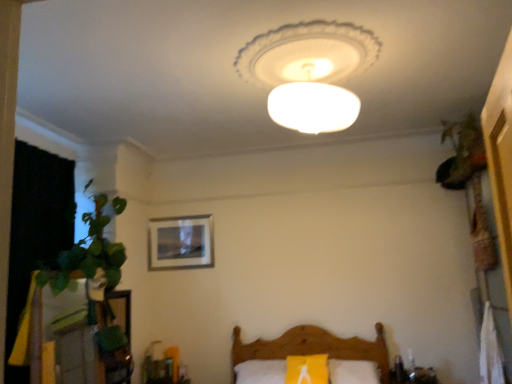
Locate an element on the screen. The image size is (512, 384). white frosted glass lampshade at center is located at coordinates (309, 72).

Identify the location of wooden picture frame at center. Image resolution: width=512 pixels, height=384 pixels. (180, 243).

Where is `green leafy plant at upper right`? This screenshot has width=512, height=384. green leafy plant at upper right is located at coordinates (462, 152).

Locate an element on the screen. white frosted glass lampshade at center is located at coordinates (309, 72).

The width and height of the screenshot is (512, 384). I want to click on plant on the right of wooden picture frame at center, so click(462, 152).

Does wooden picture frame at center appear on the right side of green leafy plant at upper right?

No.

Is wooden picture frame at center not within green leafy plant at upper right?

wooden picture frame at center lies outside green leafy plant at upper right's area.

Does green leafy plant at upper right have a greater width compared to white frosted glass lampshade at center?

No.

Is green leafy plant at upper right spatially inside white frosted glass lampshade at center, or outside of it?

green leafy plant at upper right cannot be found inside white frosted glass lampshade at center.

Based on the photo, would you consider green leafy plant at upper right to be distant from white frosted glass lampshade at center?

That's right, there is a large distance between green leafy plant at upper right and white frosted glass lampshade at center.

Considering the relative positions of green leafy plant at upper right and white frosted glass lampshade at center in the image provided, is green leafy plant at upper right to the left or to the right of white frosted glass lampshade at center?

green leafy plant at upper right is positioned on white frosted glass lampshade at center's right side.

Locate an element on the screen. The image size is (512, 384). picture frame that is below the green leafy plant at upper right (from the image's perspective) is located at coordinates (180, 243).

From a real-world perspective, who is located higher, green leafy plant at upper right or wooden picture frame at center?

green leafy plant at upper right.

Can you see green leafy plant at upper right touching wooden picture frame at center?

green leafy plant at upper right and wooden picture frame at center are clearly separated.

Considering the sizes of green leafy plant at upper right and wooden picture frame at center in the image, is green leafy plant at upper right bigger or smaller than wooden picture frame at center?

Clearly, green leafy plant at upper right is larger in size than wooden picture frame at center.

Is wooden picture frame at center behind wooden bed at lower center?

Yes, the depth of wooden picture frame at center is greater than that of wooden bed at lower center.

Locate an element on the screen. This screenshot has height=384, width=512. picture frame that appears on the left of wooden bed at lower center is located at coordinates (180, 243).

Is the surface of wooden picture frame at center in direct contact with wooden bed at lower center?

No, wooden picture frame at center is not making contact with wooden bed at lower center.

What's the angular difference between white frosted glass lampshade at center and wooden bed at lower center's facing directions?

The angular difference between white frosted glass lampshade at center and wooden bed at lower center is 170 degrees.

Based on the photo, from the image's perspective, between white frosted glass lampshade at center and wooden bed at lower center, which one is located above?

white frosted glass lampshade at center appears higher in the image.

From a real-world perspective, is white frosted glass lampshade at center physically located above or below wooden bed at lower center?

white frosted glass lampshade at center is above wooden bed at lower center.

Which is behind, point (297, 119) or point (452, 129)?

The point (452, 129) is behind.

Which of these two, white frosted glass lampshade at center or green leafy plant at upper right, is smaller?

Smaller between the two is green leafy plant at upper right.

Does white frosted glass lampshade at center appear on the right side of green leafy plant at upper right?

In fact, white frosted glass lampshade at center is to the left of green leafy plant at upper right.

At what (x,y) coordinates should I click in order to perform the action: click on picture frame behind the wooden bed at lower center. Please return your answer as a coordinate pair (x, y). Looking at the image, I should click on (180, 243).

From a real-world perspective, is wooden bed at lower center on top of wooden picture frame at center?

No, from a real-world perspective, wooden bed at lower center is not over wooden picture frame at center

Between wooden bed at lower center and wooden picture frame at center, which one appears on the left side from the viewer's perspective?

From the viewer's perspective, wooden picture frame at center appears more on the left side.

What's the angular difference between wooden bed at lower center and wooden picture frame at center's facing directions?

There is a 1.2-degree angle between the facing directions of wooden bed at lower center and wooden picture frame at center.

You are a GUI agent. You are given a task and a screenshot of the screen. Output one action in this format:
    pyautogui.click(x=<x>, y=<y>)
    Task: Click on the picture frame located behind the green leafy plant at upper right
    
    Given the screenshot: What is the action you would take?
    pyautogui.click(x=180, y=243)

The height and width of the screenshot is (384, 512). I want to click on plant below the white frosted glass lampshade at center (from the image's perspective), so click(462, 152).

When comparing their distances from wooden bed at lower center, does white frosted glass lampshade at center or wooden picture frame at center seem closer?

The object closer to wooden bed at lower center is wooden picture frame at center.

Which object lies nearer to the anchor point wooden bed at lower center, wooden picture frame at center or white frosted glass lampshade at center?

wooden picture frame at center lies closer to wooden bed at lower center than the other object.

From the image, which object appears to be nearer to wooden picture frame at center, green leafy plant at upper right or wooden bed at lower center?

wooden bed at lower center lies closer to wooden picture frame at center than the other object.

When comparing their distances from white frosted glass lampshade at center, does wooden picture frame at center or wooden bed at lower center seem closer?

wooden picture frame at center lies closer to white frosted glass lampshade at center than the other object.

Based on the photo, based on their spatial positions, is green leafy plant at upper right or wooden bed at lower center further from white frosted glass lampshade at center?

wooden bed at lower center is further to white frosted glass lampshade at center.

Estimate the real-world distances between objects in this image. Which object is closer to wooden bed at lower center, green leafy plant at upper right or white frosted glass lampshade at center?

Among the two, green leafy plant at upper right is located nearer to wooden bed at lower center.

Looking at the image, which one is located closer to green leafy plant at upper right, wooden picture frame at center or wooden bed at lower center?

wooden bed at lower center.

From the image, which object appears to be nearer to green leafy plant at upper right, white frosted glass lampshade at center or wooden picture frame at center?

The object closer to green leafy plant at upper right is white frosted glass lampshade at center.

Where is `furniture located between wooden picture frame at center and green leafy plant at upper right in the left-right direction`? This screenshot has width=512, height=384. furniture located between wooden picture frame at center and green leafy plant at upper right in the left-right direction is located at coordinates (314, 347).

Where is `furniture located between white frosted glass lampshade at center and wooden picture frame at center in the depth direction`? The image size is (512, 384). furniture located between white frosted glass lampshade at center and wooden picture frame at center in the depth direction is located at coordinates (314, 347).

At what (x,y) coordinates should I click in order to perform the action: click on plant between white frosted glass lampshade at center and wooden bed at lower center from top to bottom. Please return your answer as a coordinate pair (x, y). The width and height of the screenshot is (512, 384). Looking at the image, I should click on (462, 152).

Where is `lamp between wooden picture frame at center and green leafy plant at upper right in the horizontal direction`? lamp between wooden picture frame at center and green leafy plant at upper right in the horizontal direction is located at coordinates (309, 72).